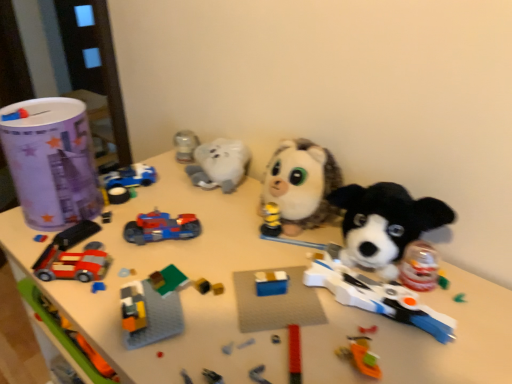
Find the location of a particular element. vacant area located to the right-hand side of blue plastic car at upper left, positioned as the third toy in right-to-left order is located at coordinates (194, 195).